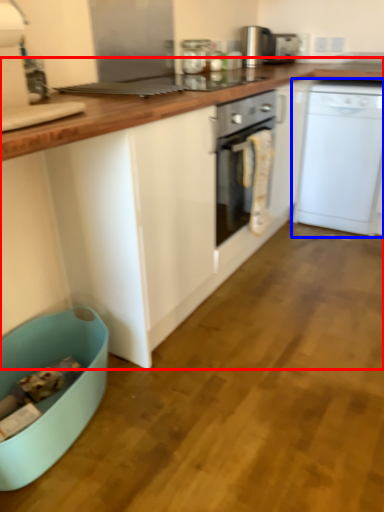
Question: Which object is closer to the camera taking this photo, cabinetry (highlighted by a red box) or home appliance (highlighted by a blue box)?

Choices:
 (A) cabinetry
 (B) home appliance

Answer: (A)